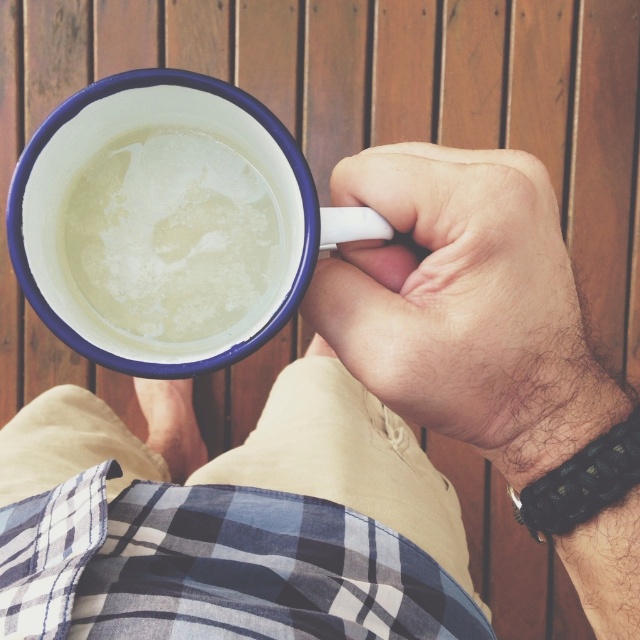
Does white enamel mug at center have a greater width compared to matte white hand at center?

Yes.

Who is more distant from viewer, [124,220] or [512,392]?

The point [124,220] is behind.

The height and width of the screenshot is (640, 640). Identify the location of white enamel mug at center. point(168,224).